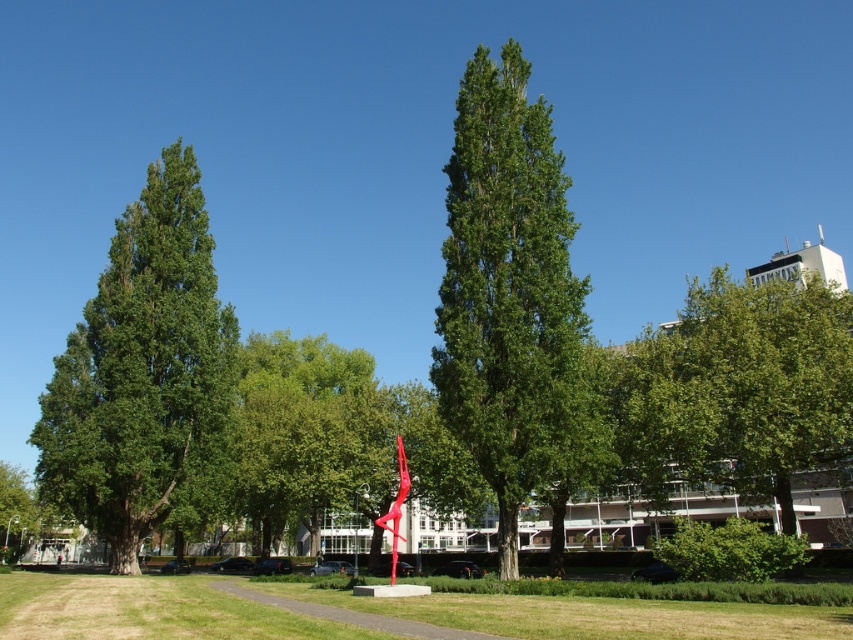
What do you see at coordinates (512, 300) in the screenshot? I see `green leafy tree at center` at bounding box center [512, 300].

Between point (556, 468) and point (755, 628), which one is positioned in front?

Point (755, 628) is in front.

This screenshot has width=853, height=640. What do you see at coordinates (512, 300) in the screenshot?
I see `green leafy tree at center` at bounding box center [512, 300].

At what (x,y) coordinates should I click in order to perform the action: click on green leafy tree at center. Please return your answer as a coordinate pair (x, y). The image size is (853, 640). Looking at the image, I should click on (512, 300).

Does green leafy tree at center have a larger size compared to green leafy tree at left?

No, green leafy tree at center is not bigger than green leafy tree at left.

Does green leafy tree at center have a lesser width compared to green leafy tree at left?

Indeed, green leafy tree at center has a lesser width compared to green leafy tree at left.

Which is behind, point (560, 433) or point (201, 444)?

The point (201, 444) is more distant.

Locate an element on the screen. green leafy tree at center is located at coordinates (512, 300).

Is point (199, 458) farther from viewer compared to point (712, 413)?

That is True.

Does green leafy tree at left come behind green leafy tree at right?

Yes, green leafy tree at left is further from the viewer.

Image resolution: width=853 pixels, height=640 pixels. What do you see at coordinates (143, 372) in the screenshot?
I see `green leafy tree at left` at bounding box center [143, 372].

Locate an element on the screen. This screenshot has height=640, width=853. green leafy tree at left is located at coordinates (143, 372).